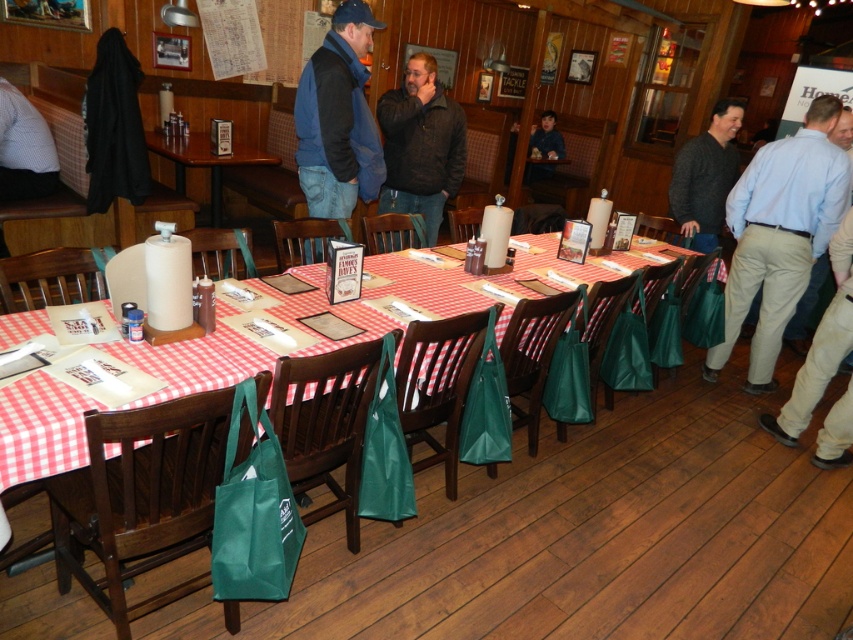
Question: Can you confirm if blue denim jacket at center is positioned above dark textured jacket at center?

Choices:
 (A) yes
 (B) no

Answer: (B)

Question: Is blue denim jacket at center below wooden table at center?

Choices:
 (A) yes
 (B) no

Answer: (A)

Question: Which is nearer to the light blue shirt at right?

Choices:
 (A) blue denim jacket at center
 (B) red checkered tablecloth at center

Answer: (B)

Question: Based on their relative distances, which object is nearer to the light blue shirt at right?

Choices:
 (A) dark gray sweater at right
 (B) wooden table at center
 (C) blue denim jacket at center
 (D) dark textured jacket at center

Answer: (A)

Question: Among these objects, which one is farthest from the camera?

Choices:
 (A) red checkered tablecloth at center
 (B) dark textured jacket at center

Answer: (B)

Question: Does red checkered tablecloth at center appear on the right side of dark textured jacket at center?

Choices:
 (A) yes
 (B) no

Answer: (A)